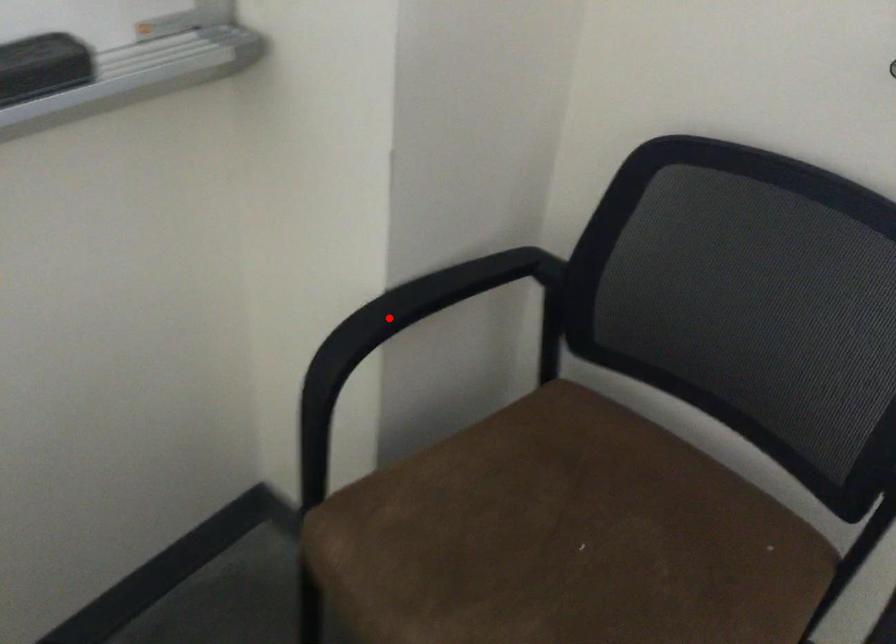
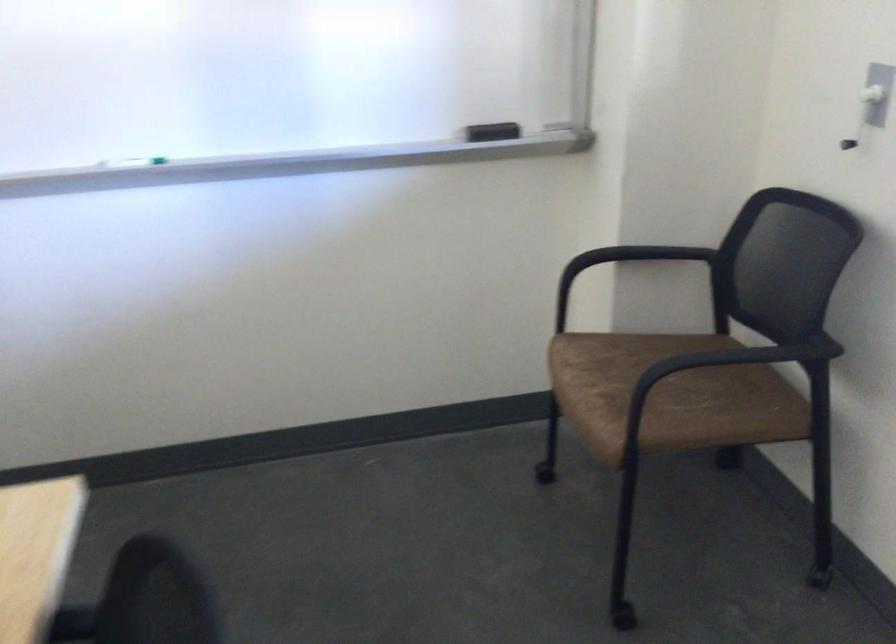
Question: I am providing you with two images of the same scene from different viewpoints. Given a red point in image1, look at the same physical point in image2. Is it:

Choices:
 (A) Closer to the viewpoint
 (B) Farther from the viewpoint

Answer: (B)